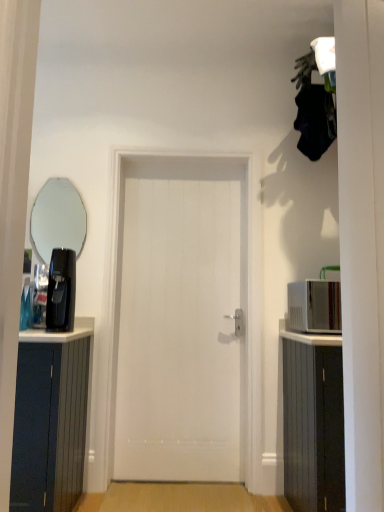
Question: Can you confirm if black plastic coffee machine at left is positioned to the right of white smooth door at center?

Choices:
 (A) yes
 (B) no

Answer: (B)

Question: Does black plastic coffee machine at left have a smaller size compared to white smooth door at center?

Choices:
 (A) yes
 (B) no

Answer: (A)

Question: From a real-world perspective, is black plastic coffee machine at left physically above white smooth door at center?

Choices:
 (A) no
 (B) yes

Answer: (B)

Question: From a real-world perspective, is black plastic coffee machine at left beneath white smooth door at center?

Choices:
 (A) yes
 (B) no

Answer: (B)

Question: Is black plastic coffee machine at left positioned with its back to white smooth door at center?

Choices:
 (A) yes
 (B) no

Answer: (B)

Question: From a real-world perspective, is white glossy microwave at right above or below white smooth door at center?

Choices:
 (A) below
 (B) above

Answer: (B)

Question: Would you say white glossy microwave at right is inside or outside white smooth door at center?

Choices:
 (A) outside
 (B) inside

Answer: (A)

Question: Would you say white glossy microwave at right is to the left or to the right of white smooth door at center in the picture?

Choices:
 (A) left
 (B) right

Answer: (B)

Question: In the image, is white glossy microwave at right positioned in front of or behind white smooth door at center?

Choices:
 (A) behind
 (B) front

Answer: (B)

Question: Considering the positions of white wood cabinet at right and clear glass mirror at upper left in the image, is white wood cabinet at right bigger or smaller than clear glass mirror at upper left?

Choices:
 (A) small
 (B) big

Answer: (B)

Question: Is point (311, 493) closer or farther from the camera than point (56, 180)?

Choices:
 (A) farther
 (B) closer

Answer: (B)

Question: Do you think white wood cabinet at right is within clear glass mirror at upper left, or outside of it?

Choices:
 (A) inside
 (B) outside

Answer: (B)

Question: In the image, is white wood cabinet at right positioned in front of or behind clear glass mirror at upper left?

Choices:
 (A) behind
 (B) front

Answer: (B)

Question: Considering the positions of white wood cabinet at right and white smooth door at center in the image, is white wood cabinet at right wider or thinner than white smooth door at center?

Choices:
 (A) wide
 (B) thin

Answer: (A)

Question: Is white wood cabinet at right inside the boundaries of white smooth door at center, or outside?

Choices:
 (A) inside
 (B) outside

Answer: (B)